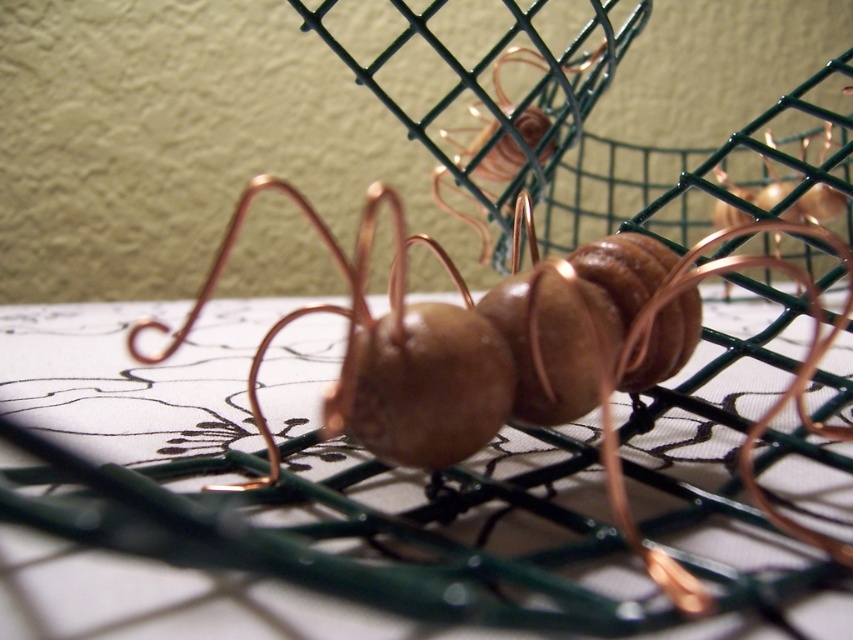
You are an artist who wants to place a small sticker exactly at the center of the shiny copper wire at center. According to the coordinates provided, where should you place the sticker?

The sticker should be placed at the coordinates point (525, 355), which is the 2D location of the shiny copper wire at center.

You are an artist examining a sculpture of an ant made from copper wire and chocolate. You notice two objects at the center of the image. One is labeled as the shiny copper wire at center, and the other is the copper wire ant at center. Which object is positioned closer to you?

The shiny copper wire at center is closer to the viewer than the copper wire ant at center.